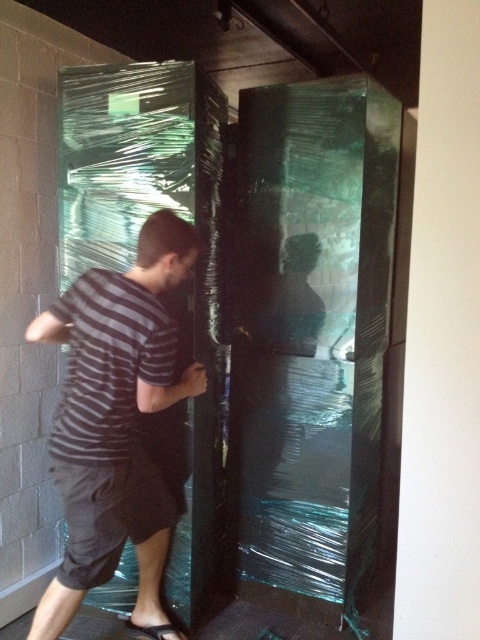
Where is the transparent plastic door at center located in the image?

The transparent plastic door at center is located at point coordinates of 0.533 on the x axis and 0.644 on the y axis.

You are a fashion designer observing the image and want to create a new line of clothing based on the scene. Which item is positioned to the left of the other between the dark gray cotton shorts at lower left and the black rubber sandal at lower center?

The dark gray cotton shorts at lower left are positioned to the left of the black rubber sandal at lower center.

You are trying to locate the black rubber sandal at lower center in the image. According to the scene, where should you look relative to the transparent plastic door at center?

The transparent plastic door at center is above the black rubber sandal at lower center, so you should look below the transparent plastic door at center to find the black rubber sandal at lower center.